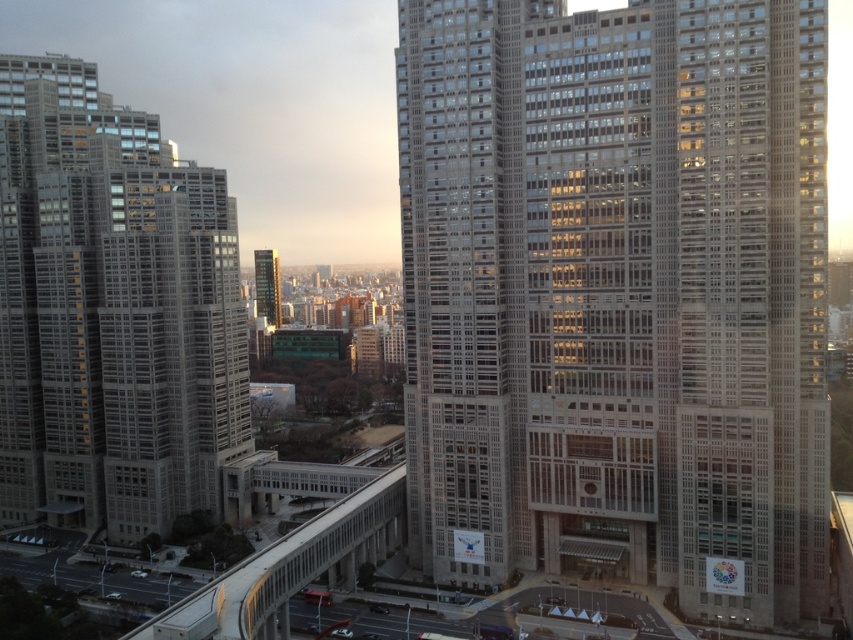
Which of these two, beige concrete building at center or gray concrete skyscraper at left, stands shorter?

beige concrete building at center is shorter.

Is point (590, 289) positioned before point (15, 408)?

That is True.

At what (x,y) coordinates should I click in order to perform the action: click on beige concrete building at center. Please return your answer as a coordinate pair (x, y). This screenshot has height=640, width=853. Looking at the image, I should click on (618, 291).

Is beige concrete building at center smaller than green glass tower at upper left?

Incorrect, beige concrete building at center is not smaller in size than green glass tower at upper left.

Does beige concrete building at center have a larger size compared to green glass tower at upper left?

Indeed, beige concrete building at center has a larger size compared to green glass tower at upper left.

Find the location of a particular element. The width and height of the screenshot is (853, 640). beige concrete building at center is located at coordinates [618, 291].

You are a GUI agent. You are given a task and a screenshot of the screen. Output one action in this format:
    pyautogui.click(x=<x>, y=<y>)
    Task: Click on the beige concrete building at center
    This screenshot has height=640, width=853.
    Given the screenshot: What is the action you would take?
    pyautogui.click(x=618, y=291)

Who is shorter, gray concrete skyscraper at left or green glass tower at upper left?

With less height is green glass tower at upper left.

Who is more forward, (68,77) or (267,273)?

Point (68,77)

Between point (183, 412) and point (262, 273), which one is positioned in front?

Point (183, 412) is in front.

The image size is (853, 640). What are the coordinates of `gray concrete skyscraper at left` in the screenshot? It's located at (111, 312).